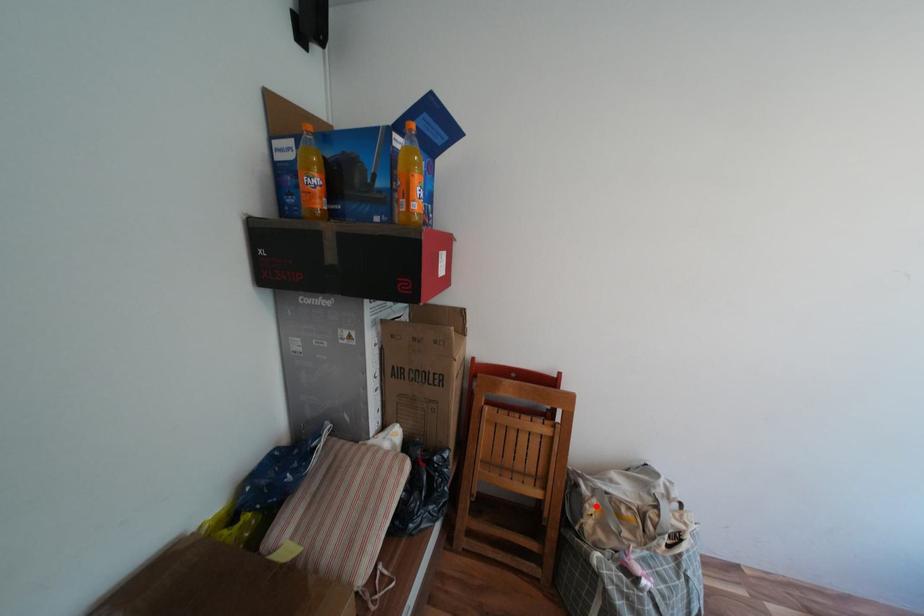
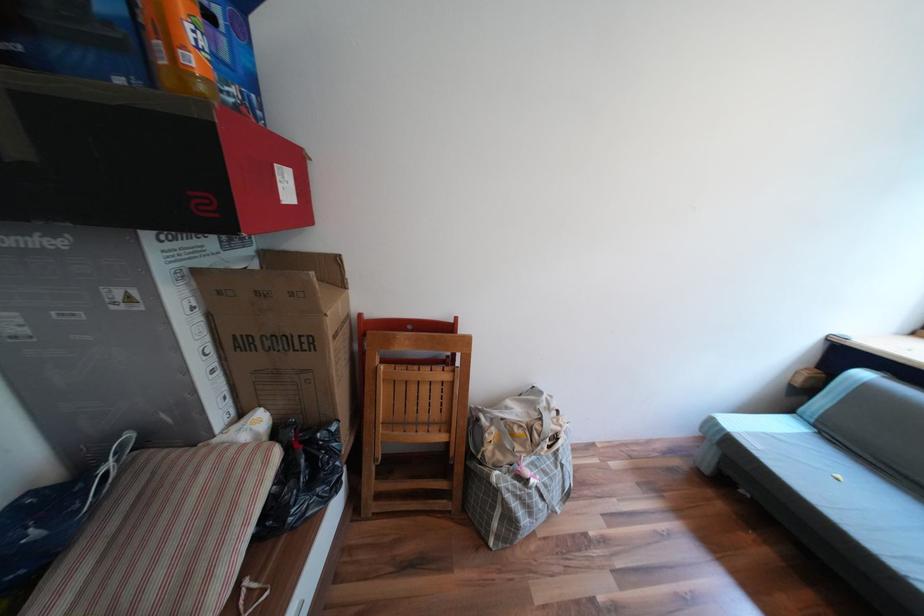
Locate, in the second image, the point that corresponds to the highlighted location in the first image.

(495, 435)